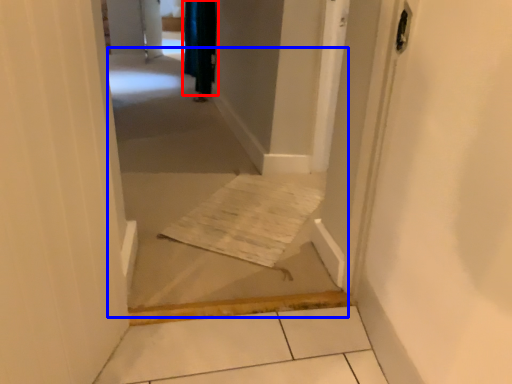
Question: Among these objects, which one is farthest to the camera, curtain (highlighted by a red box) or corridor (highlighted by a blue box)?

Choices:
 (A) curtain
 (B) corridor

Answer: (A)